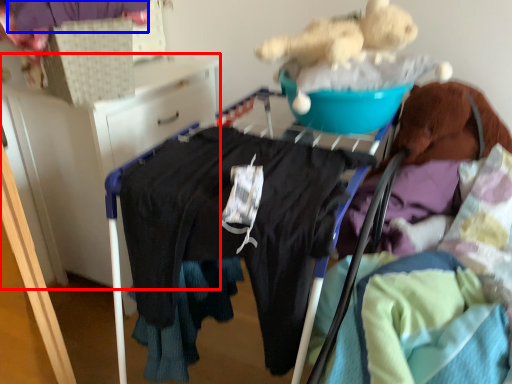
Question: Which object appears closest to the camera in this image, furniture (highlighted by a red box) or clothing (highlighted by a blue box)?

Choices:
 (A) furniture
 (B) clothing

Answer: (B)